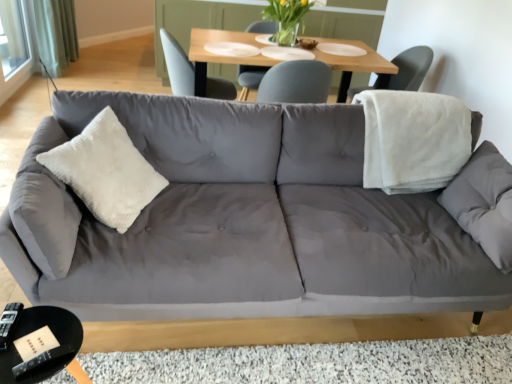
Locate an element on the screen. free space in front of translucent glass vase at upper center is located at coordinates (288, 50).